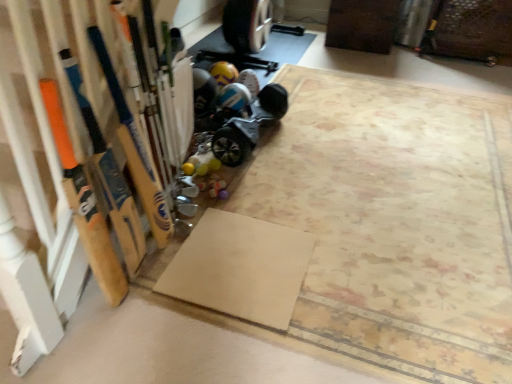
Question: Considering the relative positions of wooden baseball bat at left, the first baseball bat when ordered from left to right, and beige matte yoga mat at lower center in the image provided, is wooden baseball bat at left, the first baseball bat when ordered from left to right, to the left or to the right of beige matte yoga mat at lower center?

Choices:
 (A) left
 (B) right

Answer: (A)

Question: In the image, is wooden baseball bat at left, the first baseball bat when ordered from left to right, positioned in front of or behind beige matte yoga mat at lower center?

Choices:
 (A) behind
 (B) front

Answer: (B)

Question: Considering the real-world distances, which object is farthest from the wooden baseball bat at left, which ranks as the 2th baseball bat in right-to-left order?

Choices:
 (A) blue metallic hoverboard at lower center
 (B) beige matte yoga mat at lower center
 (C) wooden baseball bat at left, placed as the 2th baseball bat when sorted from left to right

Answer: (A)

Question: Estimate the real-world distances between objects in this image. Which object is farther from the beige matte yoga mat at lower center?

Choices:
 (A) blue metallic hoverboard at lower center
 (B) wooden baseball bat at left, placed as the 2th baseball bat when sorted from left to right
 (C) wooden baseball bat at left, which ranks as the 2th baseball bat in right-to-left order

Answer: (A)